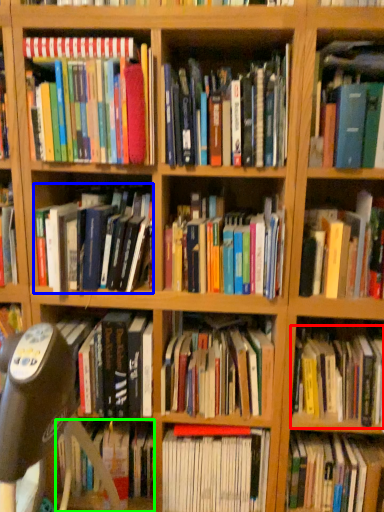
Question: Based on their relative distances, which object is farther from book (highlighted by a red box)? Choose from book (highlighted by a blue box) and book (highlighted by a green box).

Choices:
 (A) book
 (B) book

Answer: (B)